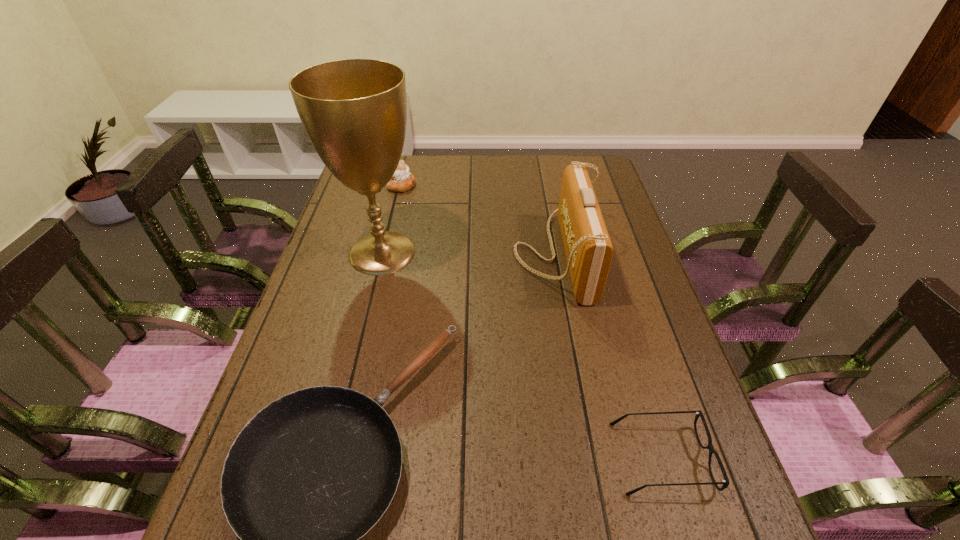
What are the coordinates of `object that is the closest to the handbag` in the screenshot? It's located at (310, 474).